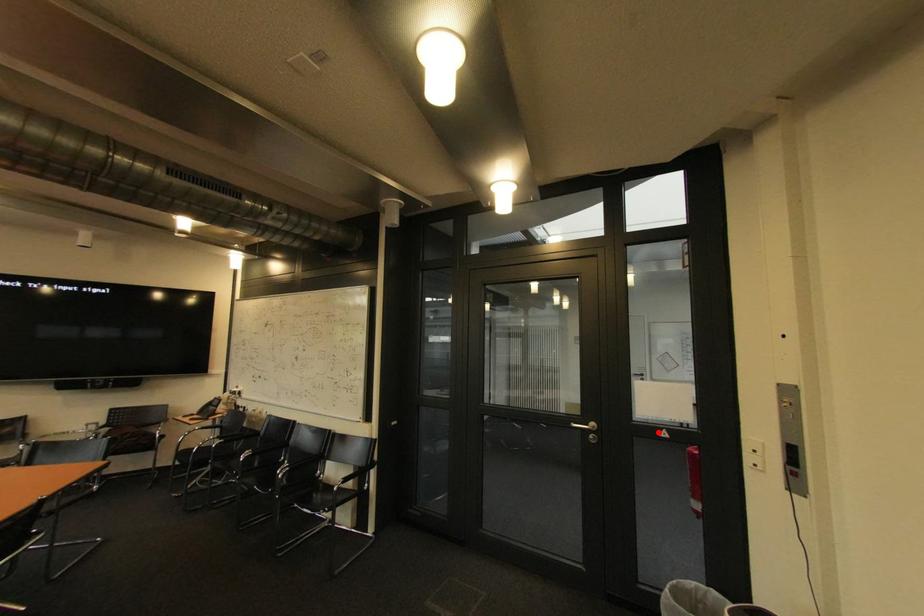
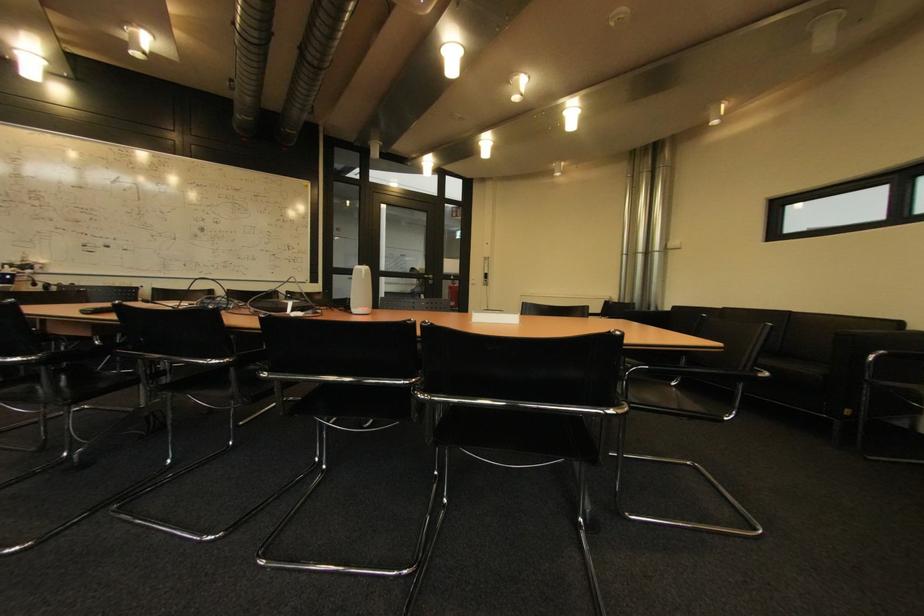
Question: I am providing you with two images of the same scene from different viewpoints. A red point is shown in image1. For the corresponding object point in image2, is it positioned nearer or farther from the camera?

Choices:
 (A) Nearer
 (B) Farther

Answer: (A)